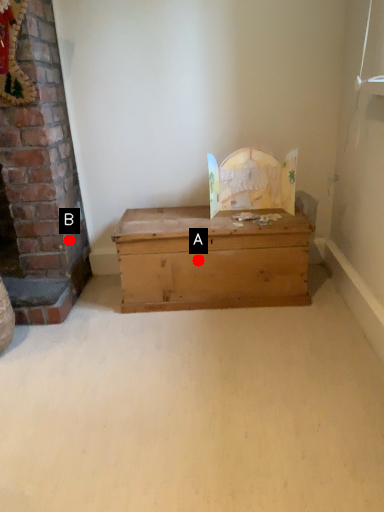
Question: Two points are circled on the image, labeled by A and B beside each circle. Which of the following is the farthest from the observer?

Choices:
 (A) A is further
 (B) B is further

Answer: (B)